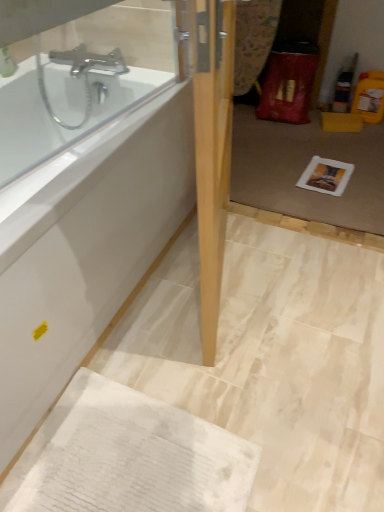
Identify the location of free space that is in between light wood door at center and white textured towel at lower left. This screenshot has height=512, width=384. pos(186,338).